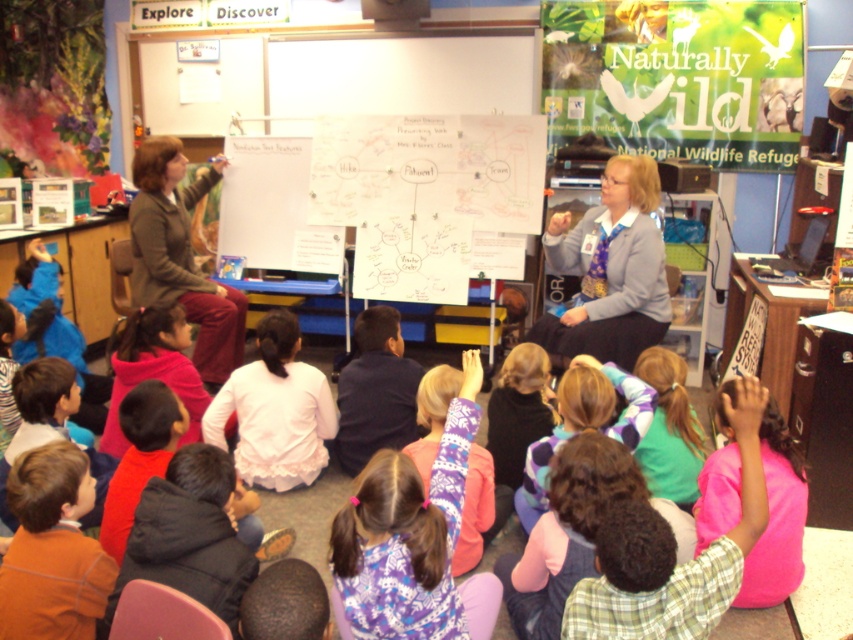
Question: Which point is farther to the camera?

Choices:
 (A) matte gray sweater at center
 (B) pink fleece sweater at lower right
 (C) matte green jacket at upper left
 (D) orange cotton shirt at lower left

Answer: (C)

Question: Which object appears farthest from the camera in this image?

Choices:
 (A) matte gray sweater at center
 (B) matte green jacket at upper left
 (C) purple fleece sweater at center
 (D) pink fleece sweater at lower right

Answer: (B)

Question: Is purple fleece sweater at center smaller than matte green jacket at upper left?

Choices:
 (A) no
 (B) yes

Answer: (B)

Question: Which point is closer to the camera?

Choices:
 (A) matte green jacket at upper left
 (B) orange cotton shirt at lower left

Answer: (B)

Question: Can you confirm if pink fleece sweater at lower right is bigger than orange cotton shirt at lower left?

Choices:
 (A) yes
 (B) no

Answer: (A)

Question: Can you confirm if matte gray sweater at center is positioned above orange cotton shirt at lower left?

Choices:
 (A) no
 (B) yes

Answer: (B)